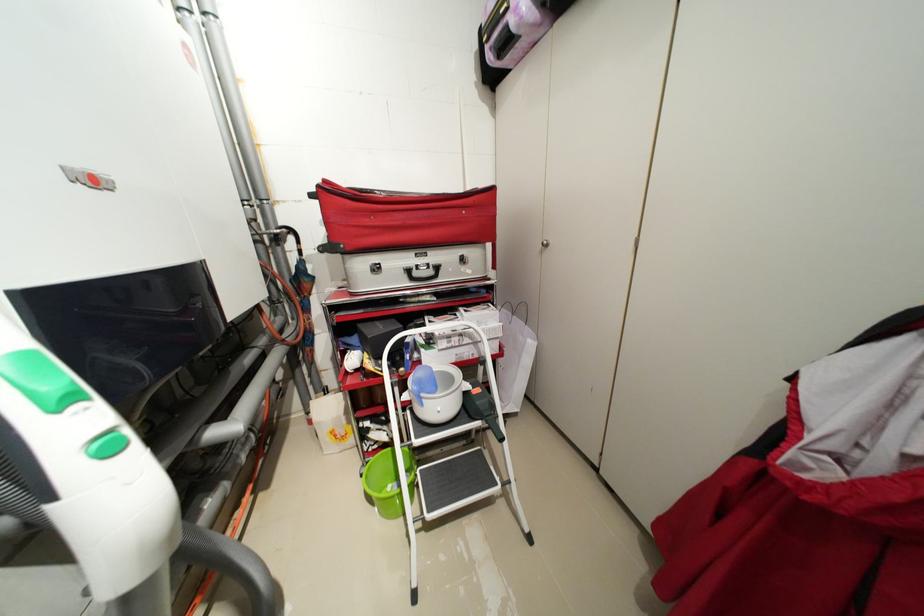
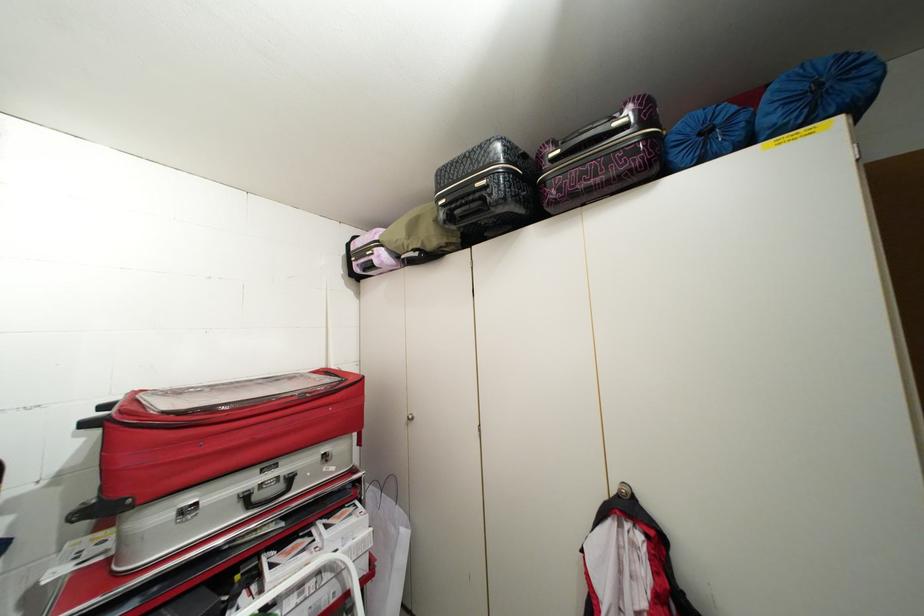
Locate, in the second image, the point that corresponds to point (439, 273) in the first image.

(287, 487)